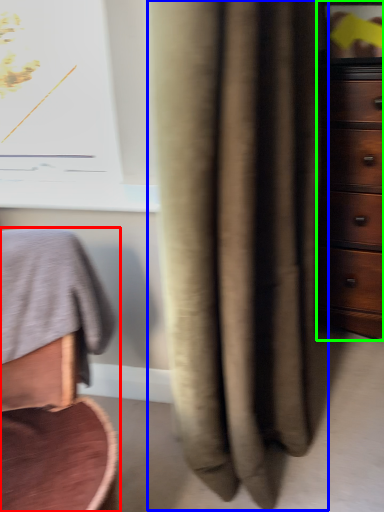
Question: Estimate the real-world distances between objects in this image. Which object is closer to furniture (highlighted by a red box), curtain (highlighted by a blue box) or chest of drawers (highlighted by a green box)?

Choices:
 (A) curtain
 (B) chest of drawers

Answer: (A)